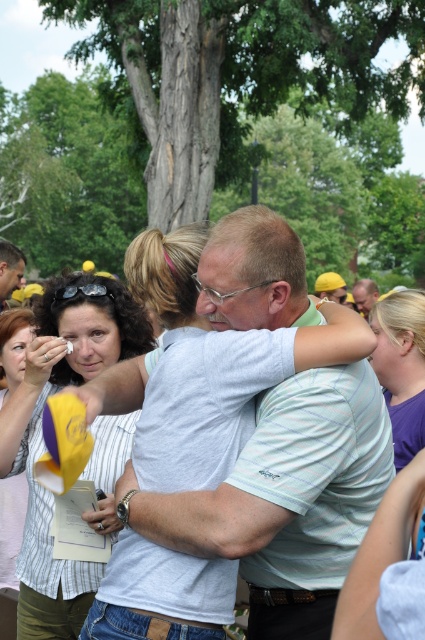
You are a photographer trying to capture a group photo of the light blue striped shirt at center and the matte gray shirt at center. Based on their positions, which one should you position closer to the edge of the frame to ensure both are fully visible?

The light blue striped shirt at center might be wider than matte gray shirt at center, so positioning the light blue striped shirt at center closer to the edge would allow more space for the wider object while keeping both within the frame.

You are a photographer at this event and want to capture a photo of both the light blue striped shirt at center and the matte gray shirt at center in the same frame. Considering their heights, which one should you position closer to the camera to ensure both are fully visible?

The light blue striped shirt at center is much taller than the matte gray shirt at center. To ensure both are fully visible, position the shorter matte gray shirt at center closer to the camera so its full height can be captured alongside the taller individual.